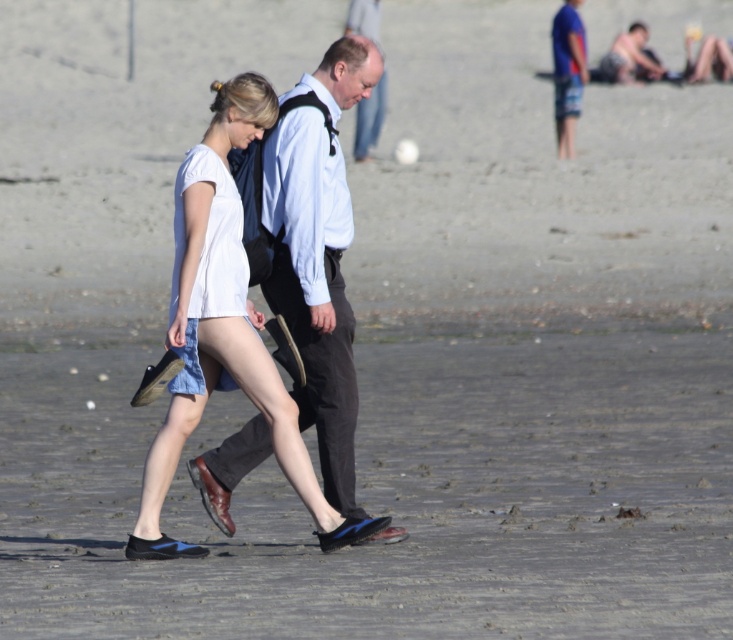
How much distance is there between blue denim shorts at upper right and light blue shirt at center?

blue denim shorts at upper right is 5.37 meters away from light blue shirt at center.

Between blue denim shorts at upper right and light blue shirt at center, which one has more height?

Standing taller between the two is light blue shirt at center.

Who is more forward, (564, 54) or (360, 17)?

Point (564, 54) is in front.

The height and width of the screenshot is (640, 733). In order to click on blue denim shorts at upper right in this screenshot , I will do `click(567, 74)`.

Looking at this image, is white denim dress at center smaller than light blue shirt at center?

Yes.

Is white denim dress at center bigger than light blue shirt at center?

Actually, white denim dress at center might be smaller than light blue shirt at center.

Describe the element at coordinates (207, 260) in the screenshot. This screenshot has width=733, height=640. I see `white denim dress at center` at that location.

The width and height of the screenshot is (733, 640). Identify the location of white denim dress at center. (207, 260).

Between white denim dress at center and blue denim shorts at upper right, which one is positioned higher?

blue denim shorts at upper right is above.

Who is more distant from viewer, (237, 259) or (559, 13)?

The point (559, 13) is behind.

Locate an element on the screen. The image size is (733, 640). white denim dress at center is located at coordinates (207, 260).